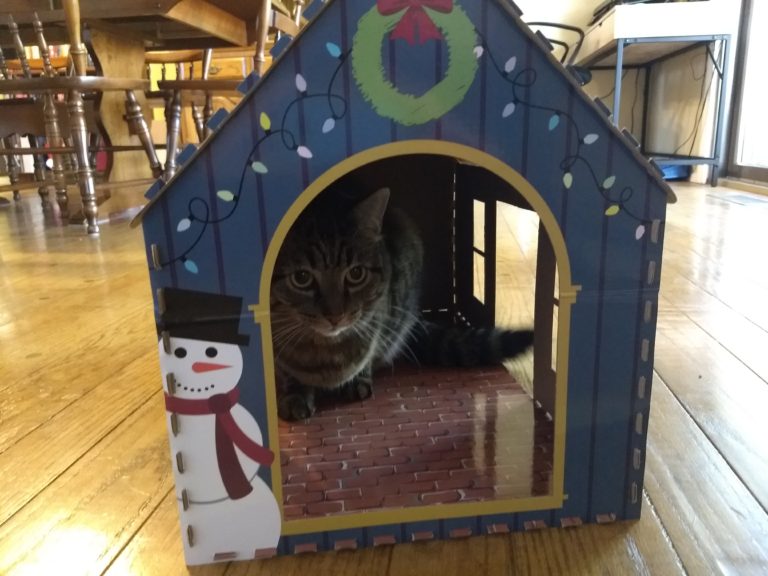
This screenshot has height=576, width=768. Identify the location of cat house. (343, 141).